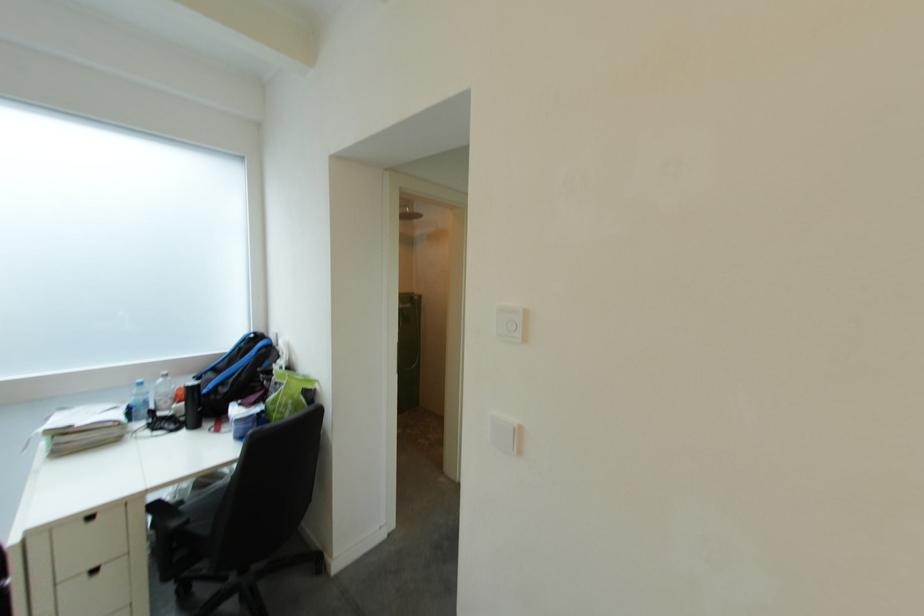
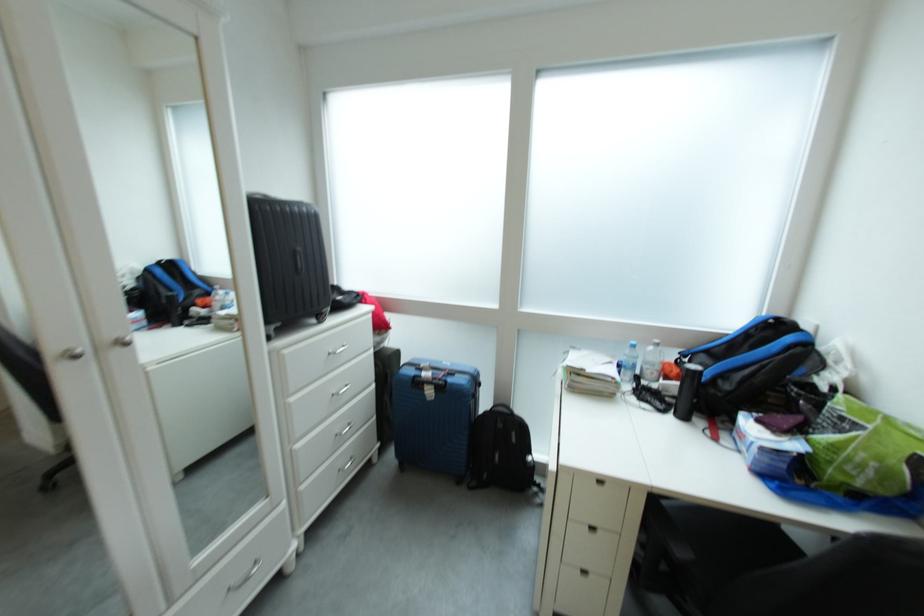
In the second image, find the point that corresponds to pixel 235 392 in the first image.

(737, 390)